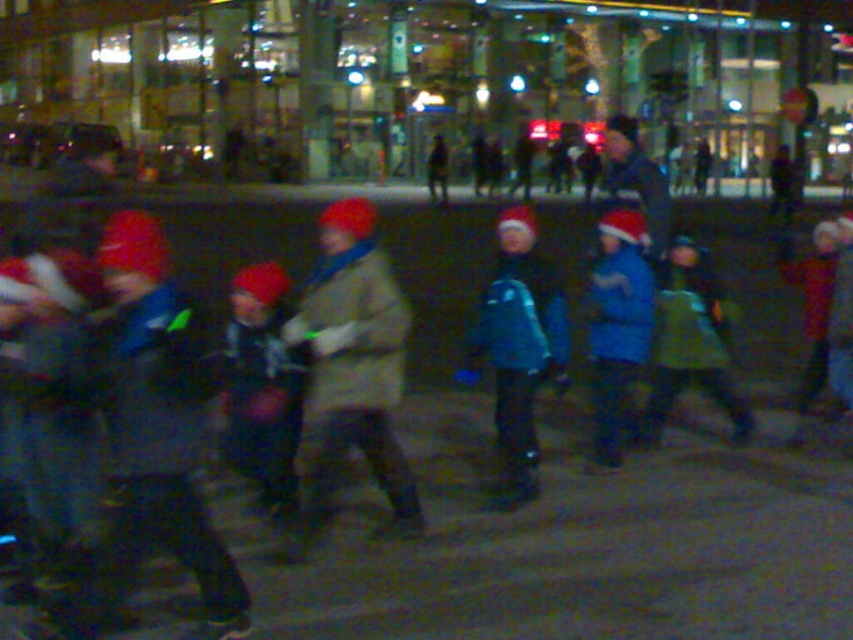
Question: Which object is the farthest from the camouflage fabric jacket at center?

Choices:
 (A) velvet red hat at center
 (B) blue matte jacket at center
 (C) teal fabric jacket at center

Answer: (B)

Question: Can you confirm if teal fabric jacket at center is positioned below blue matte jacket at center?

Choices:
 (A) yes
 (B) no

Answer: (B)

Question: Can you confirm if camouflage fabric jacket at center is bigger than blue matte jacket at center?

Choices:
 (A) yes
 (B) no

Answer: (A)

Question: Can you confirm if camouflage fabric jacket at center is bigger than velvet red hat at center?

Choices:
 (A) yes
 (B) no

Answer: (A)

Question: Which of the following is the farthest from the observer?

Choices:
 (A) teal fabric jacket at center
 (B) camouflage fabric jacket at center

Answer: (A)

Question: Estimate the real-world distances between objects in this image. Which object is closer to the teal fabric jacket at center?

Choices:
 (A) camouflage fabric jacket at center
 (B) blue matte jacket at center

Answer: (B)